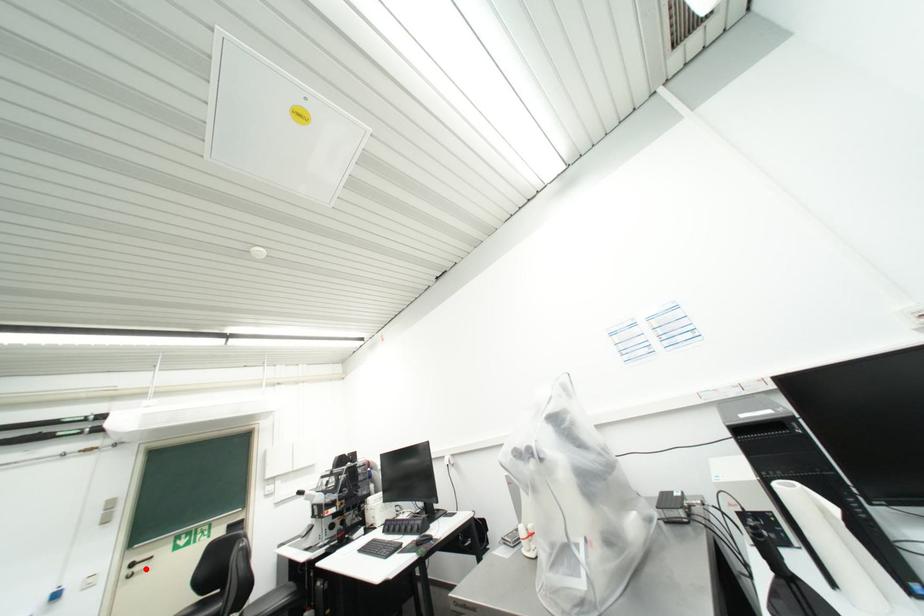
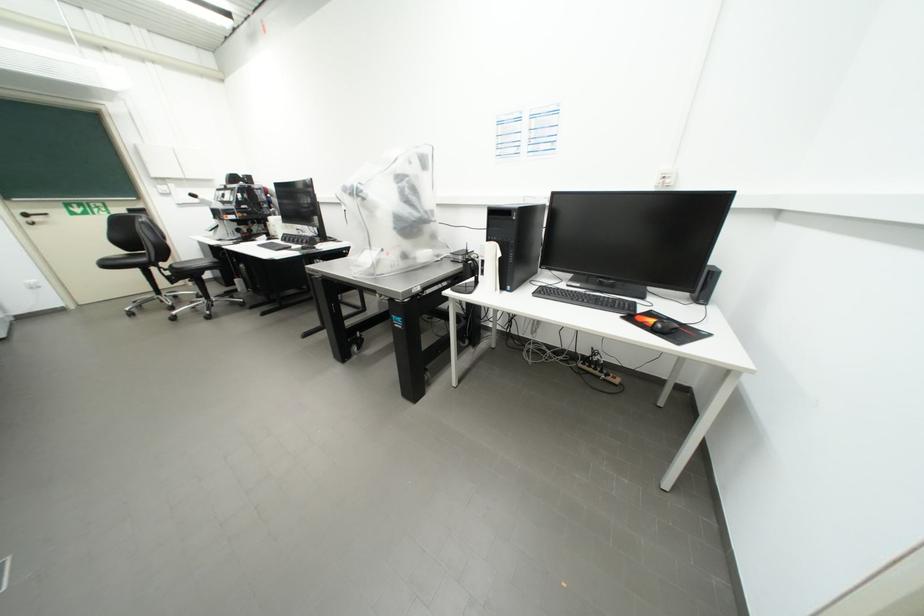
Question: I am providing you with two images of the same scene from different viewpoints. In image1, a red point is highlighted. Considering the same 3D point in image2, which of the following is correct?

Choices:
 (A) It is closer
 (B) It is farther

Answer: (B)